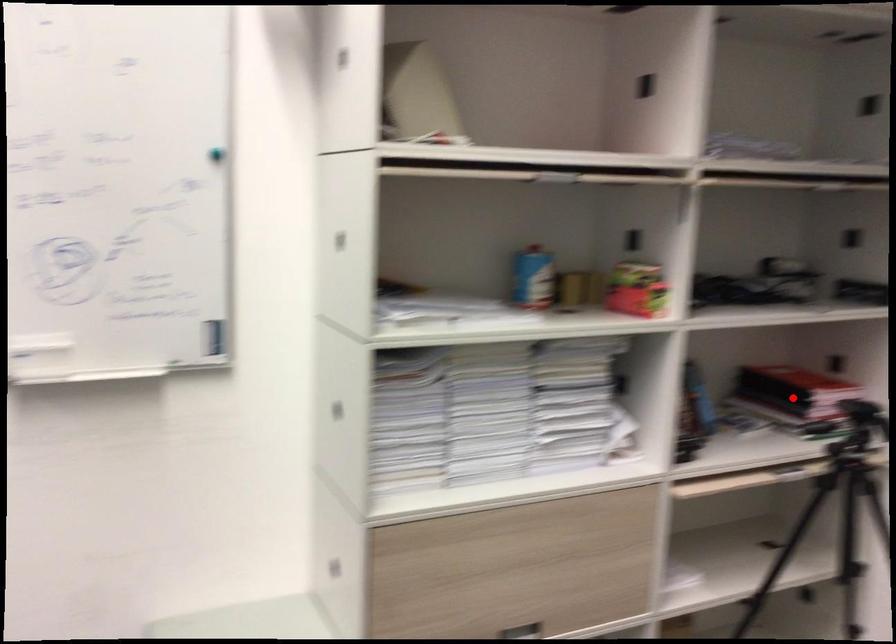
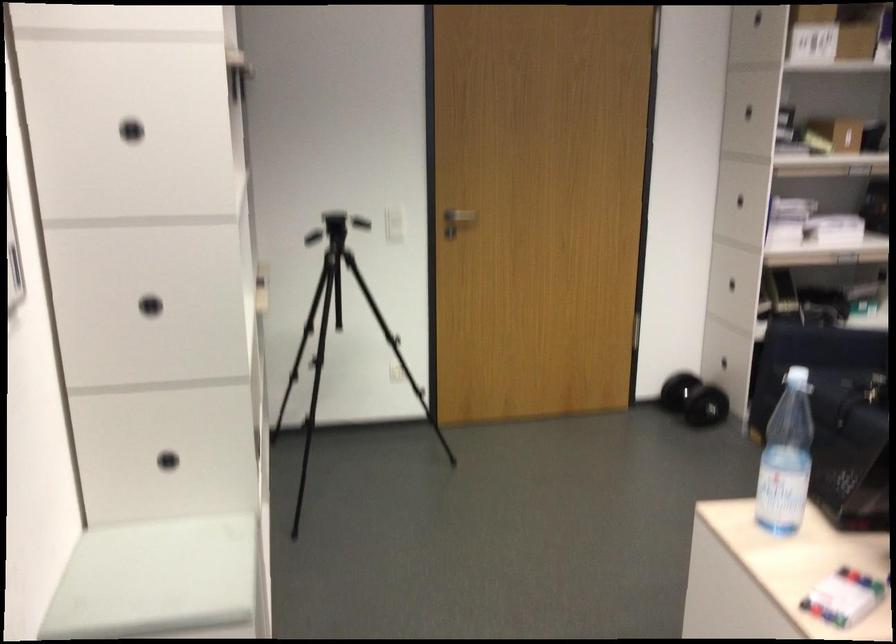
Question: I am providing you with two images of the same scene from different viewpoints. A red point is marked on the first image. Is the red point's position out of view in image 2?

Choices:
 (A) Yes
 (B) No

Answer: (A)